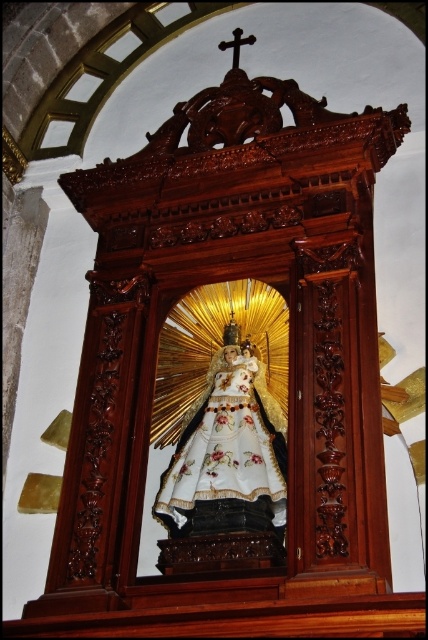
Can you confirm if white satin robe at center is shorter than polished dark wood cross at upper center?

Incorrect, white satin robe at center's height does not fall short of polished dark wood cross at upper center's.

In order to click on white satin robe at center in this screenshot , I will do `click(226, 444)`.